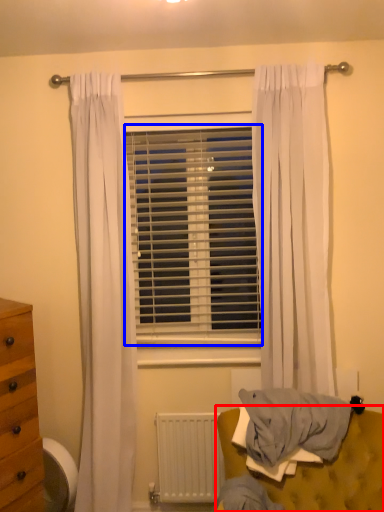
Question: Which of the following is the farthest to the observer, furniture (highlighted by a red box) or window blind (highlighted by a blue box)?

Choices:
 (A) furniture
 (B) window blind

Answer: (B)